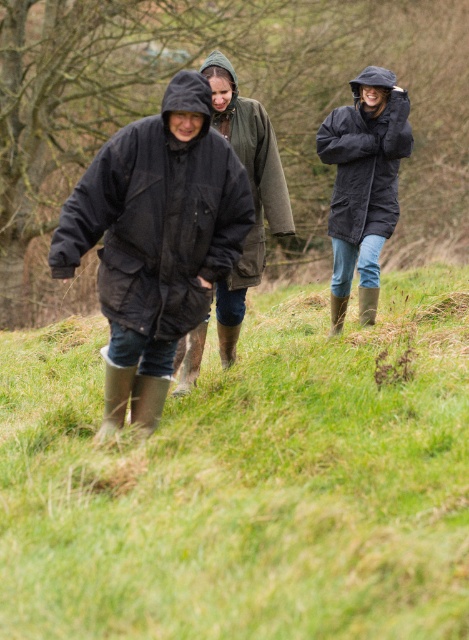
You are a hiker trying to locate your two friends in the rain. You see a matte black jacket at center and a black waterproof jacket at upper right. Which friend is positioned to the left of the other?

The matte black jacket at center is to the left of the black waterproof jacket at upper right.

Based on the scene description, which object corresponds to the coordinates point (x=158, y=218)?

The black matte jacket at left corresponds to the coordinates point (x=158, y=218).

Based on the scene description, where is the green grass at center located in terms of coordinates?

The green grass at center is located at point coordinates of (246, 481).